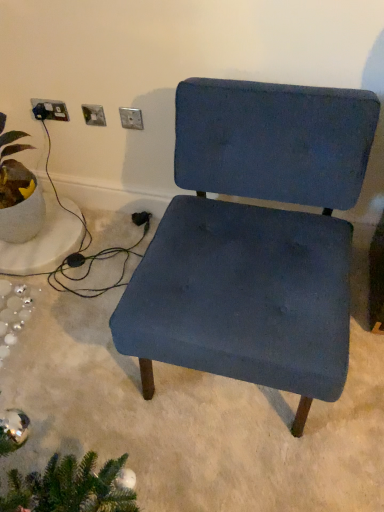
Question: Considering the relative positions of matte ceramic plant at left and velvet blue chair at center in the image provided, is matte ceramic plant at left to the left or to the right of velvet blue chair at center?

Choices:
 (A) right
 (B) left

Answer: (B)

Question: Considering the positions of matte ceramic plant at left and velvet blue chair at center in the image, is matte ceramic plant at left bigger or smaller than velvet blue chair at center?

Choices:
 (A) small
 (B) big

Answer: (A)

Question: Which object is positioned farthest from the velvet blue chair at center?

Choices:
 (A) matte ceramic plant at left
 (B) metallic silver outlet at upper center, the third electric outlet when ordered from left to right
 (C) satin silver socket at upper left, the 1th electric outlet when ordered from left to right
 (D) satin silver socket at upper center, which appears as the second electric outlet when viewed from the right

Answer: (C)

Question: Based on their relative distances, which object is nearer to the matte ceramic plant at left?

Choices:
 (A) satin silver socket at upper center, acting as the second electric outlet starting from the left
 (B) metallic silver outlet at upper center, the third electric outlet when ordered from left to right
 (C) satin silver socket at upper left, the 1th electric outlet when ordered from left to right
 (D) velvet blue chair at center

Answer: (C)